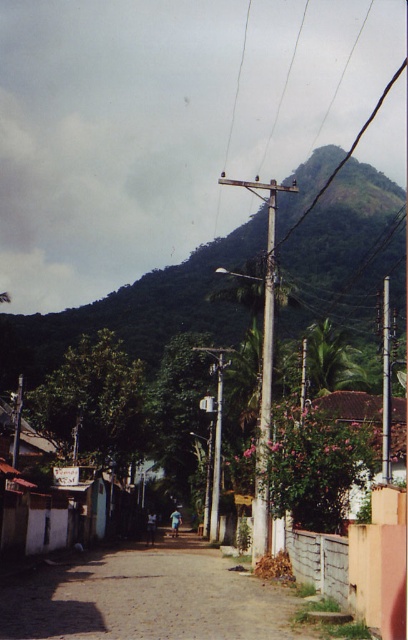
Which of these two, brown cobblestone alley at center or brown wooden pole at upper center, stands shorter?

Standing shorter between the two is brown cobblestone alley at center.

Find the location of a particular element. The image size is (408, 640). brown cobblestone alley at center is located at coordinates (148, 596).